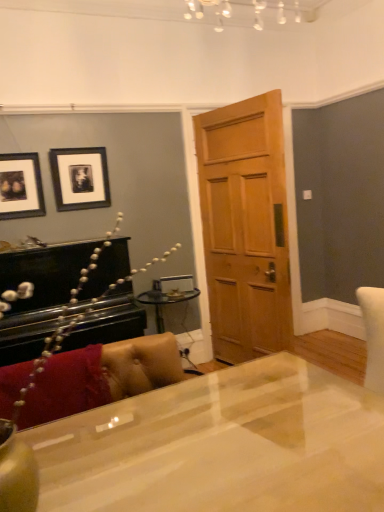
Question: Is glossy white desk at center positioned behind black matte picture frame at upper left, which is counted as the 1th picture frame, starting from the right?

Choices:
 (A) yes
 (B) no

Answer: (B)

Question: Is glossy white desk at center to the right of black matte picture frame at upper left, which is counted as the 1th picture frame, starting from the right, from the viewer's perspective?

Choices:
 (A) yes
 (B) no

Answer: (A)

Question: Considering the relative positions of glossy white desk at center and black matte picture frame at upper left, placed as the 2th picture frame when sorted from left to right, in the image provided, is glossy white desk at center in front of black matte picture frame at upper left, placed as the 2th picture frame when sorted from left to right,?

Choices:
 (A) yes
 (B) no

Answer: (A)

Question: Can you confirm if glossy white desk at center is bigger than black matte picture frame at upper left, which is counted as the 1th picture frame, starting from the right?

Choices:
 (A) no
 (B) yes

Answer: (B)

Question: Could black matte picture frame at upper left, placed as the 2th picture frame when sorted from left to right, be considered to be inside glossy white desk at center?

Choices:
 (A) yes
 (B) no

Answer: (B)

Question: From the image's perspective, is black matte picture frame at upper left, which is counted as the 1th picture frame, starting from the right, positioned above or below glossy white desk at center?

Choices:
 (A) above
 (B) below

Answer: (A)

Question: From a real-world perspective, relative to glossy white desk at center, is black matte picture frame at upper left, which is counted as the 1th picture frame, starting from the right, vertically above or below?

Choices:
 (A) above
 (B) below

Answer: (A)

Question: Based on their positions, is black matte picture frame at upper left, placed as the 2th picture frame when sorted from left to right, located to the left or right of glossy white desk at center?

Choices:
 (A) right
 (B) left

Answer: (B)

Question: Considering the positions of point (61, 198) and point (336, 472), is point (61, 198) closer or farther from the camera than point (336, 472)?

Choices:
 (A) closer
 (B) farther

Answer: (B)

Question: From a real-world perspective, relative to black matte picture frame at upper left, placed as the 2th picture frame when sorted from left to right, is wooden door at center vertically above or below?

Choices:
 (A) below
 (B) above

Answer: (A)

Question: Based on their positions, is wooden door at center located to the left or right of black matte picture frame at upper left, which is counted as the 1th picture frame, starting from the right?

Choices:
 (A) right
 (B) left

Answer: (A)

Question: In terms of height, does wooden door at center look taller or shorter compared to black matte picture frame at upper left, which is counted as the 1th picture frame, starting from the right?

Choices:
 (A) short
 (B) tall

Answer: (B)

Question: Is wooden door at center wider or thinner than black matte picture frame at upper left, placed as the 2th picture frame when sorted from left to right?

Choices:
 (A) wide
 (B) thin

Answer: (A)

Question: Looking at their shapes, would you say leather couch at lower left is wider or thinner than matte black picture frame at upper left, marked as the 2th picture frame in a right-to-left arrangement?

Choices:
 (A) thin
 (B) wide

Answer: (B)

Question: From their relative heights in the image, would you say leather couch at lower left is taller or shorter than matte black picture frame at upper left, marked as the 2th picture frame in a right-to-left arrangement?

Choices:
 (A) tall
 (B) short

Answer: (B)